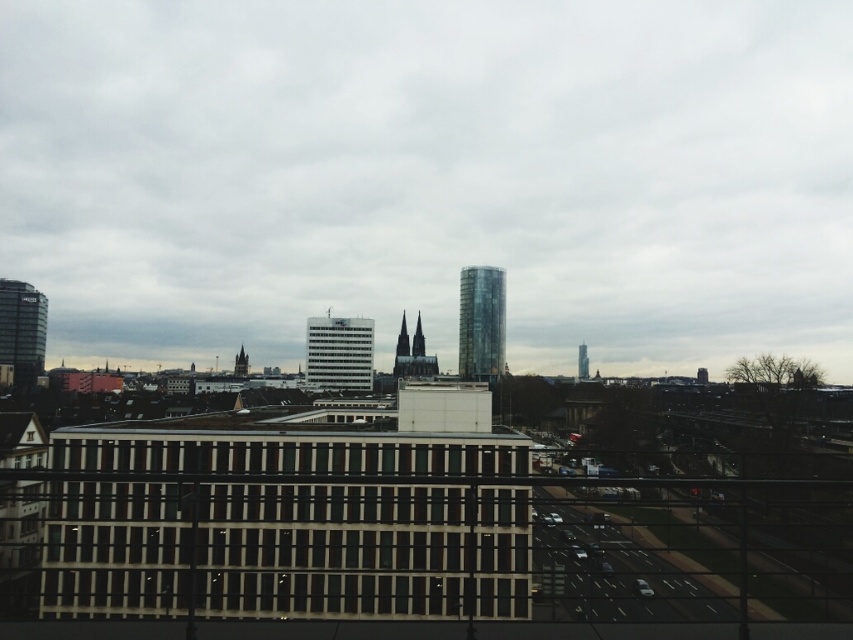
Is matte glass skyscraper at left taller than glassy modern skyscraper at center?

Correct, matte glass skyscraper at left is much taller as glassy modern skyscraper at center.

Can you confirm if matte glass skyscraper at left is positioned to the left of glassy modern skyscraper at center?

Indeed, matte glass skyscraper at left is positioned on the left side of glassy modern skyscraper at center.

Locate an element on the screen. matte glass skyscraper at left is located at coordinates (22, 330).

Which is more to the left, transparent glass tower at center or glassy modern skyscraper at center?

transparent glass tower at center is more to the left.

Does transparent glass tower at center have a greater height compared to glassy modern skyscraper at center?

Yes.

Does point (479, 333) come farther from viewer compared to point (583, 362)?

No, it is not.

This screenshot has width=853, height=640. What are the coordinates of `transparent glass tower at center` in the screenshot? It's located at (480, 323).

Between point (22, 289) and point (241, 356), which one is positioned behind?

The point (241, 356) is more distant.

Is matte glass skyscraper at left further to camera compared to dark brown stone tower at center?

That is False.

Between point (38, 320) and point (241, 346), which one is positioned in front?

Point (38, 320) is more forward.

Identify the location of matte glass skyscraper at left. (22, 330).